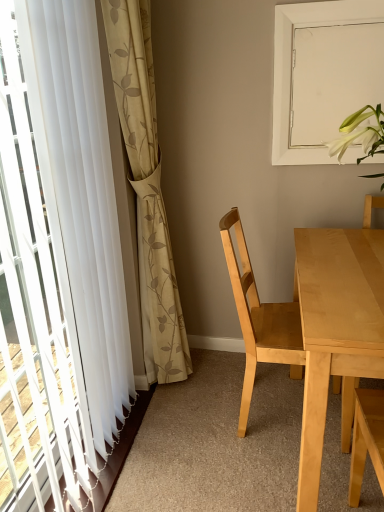
The width and height of the screenshot is (384, 512). Identify the location of free area below beige floral fabric curtain at left, positioned as the second curtain in left-to-right order (from a real-world perspective). (172, 395).